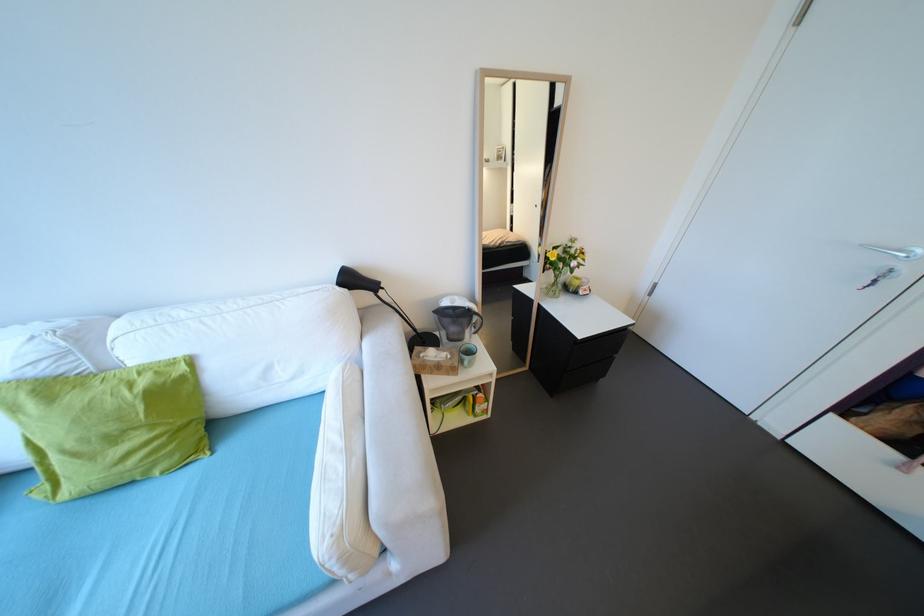
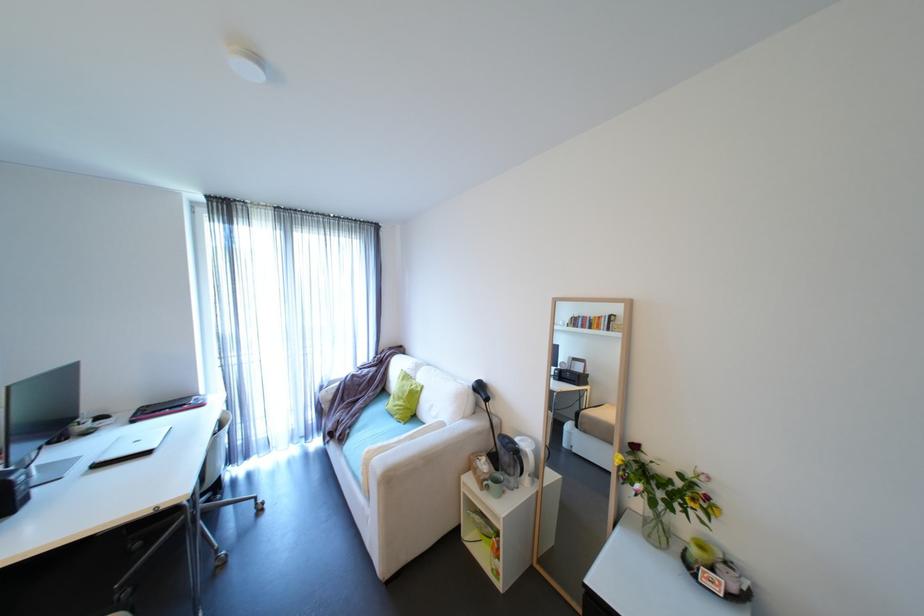
In the second image, find the point that corresponds to the point at 578,246 in the first image.

(703, 485)